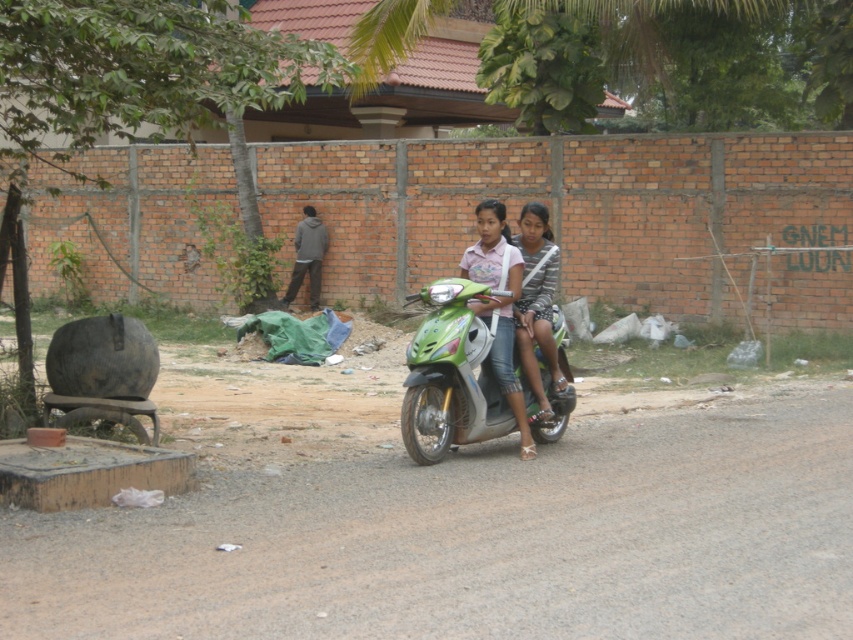
Question: Estimate the real-world distances between objects in this image. Which object is closer to the green glossy scooter at center?

Choices:
 (A) striped fabric dress at center
 (B) dirt track at lower center
 (C) pink fabric shirt at center

Answer: (C)

Question: Which of the following is the closest to the observer?

Choices:
 (A) (548, 301)
 (B) (822, 442)
 (C) (502, 323)

Answer: (C)

Question: Which object is the closest to the dirt track at lower center?

Choices:
 (A) green glossy scooter at center
 (B) striped fabric dress at center
 (C) pink fabric shirt at center

Answer: (A)

Question: Is pink fabric shirt at center closer to camera compared to striped fabric dress at center?

Choices:
 (A) yes
 (B) no

Answer: (A)

Question: In this image, where is green glossy scooter at center located relative to striped fabric dress at center?

Choices:
 (A) below
 (B) above

Answer: (A)

Question: Can you confirm if dirt track at lower center is positioned to the left of green glossy scooter at center?

Choices:
 (A) yes
 (B) no

Answer: (B)